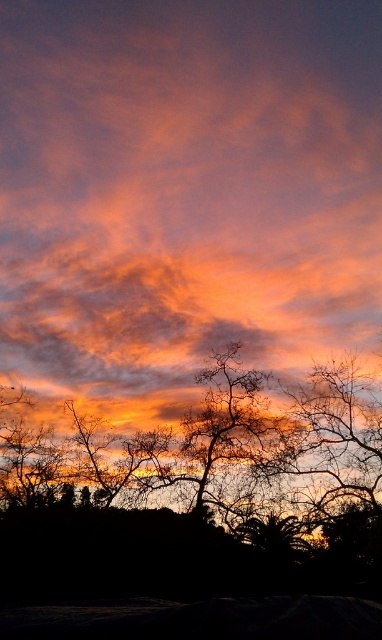
You are an astronomer analyzing the sunset scene. You notice a point at coordinates point (184, 192). Based on the image description, what does this point represent?

The point (184, 192) represents the cloudy orange sky at center.

You are an astronomer analyzing the sunset image. You need to locate the cloudy orange sky at center in the image. What are its coordinates?

The cloudy orange sky at center is located at coordinates (184, 192).

You are standing in the sunset scene and want to take a photo of the silhouette leafless tree at bottom. Where should you position yourself to capture the tree in the center of your viewfinder?

To center the silhouette leafless tree at bottom in your viewfinder, position yourself directly in line with its coordinates at point [202,477].